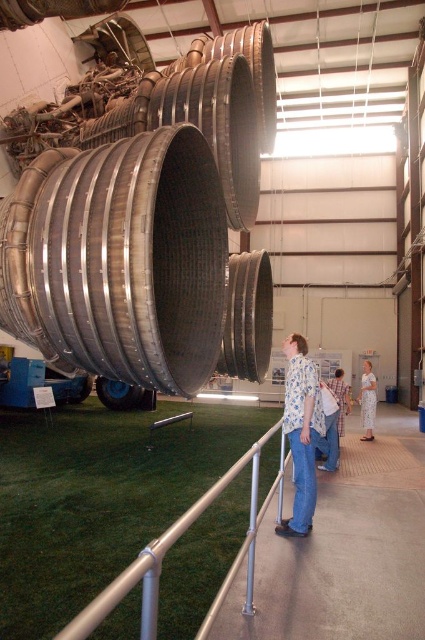
Between point (302, 444) and point (328, 420), which one is positioned behind?

Positioned behind is point (328, 420).

Between floral shirt at center and blue plaid shirt at center, which one has more height?

With more height is floral shirt at center.

Locate an element on the screen. The height and width of the screenshot is (640, 425). floral shirt at center is located at coordinates (302, 433).

Does floral shirt at center appear over white floral dress at center?

Correct, floral shirt at center is located above white floral dress at center.

Is floral shirt at center wider than white floral dress at center?

No.

Between point (312, 394) and point (368, 360), which one is positioned behind?

Positioned behind is point (368, 360).

This screenshot has height=640, width=425. I want to click on floral shirt at center, so click(302, 433).

Between silver metallic rail at center and white floral dress at center, which one appears on the right side from the viewer's perspective?

white floral dress at center

Between point (201, 504) and point (359, 392), which one is positioned in front?

Point (201, 504) is in front.

Is point (282, 456) less distant than point (371, 401)?

Yes.

Image resolution: width=425 pixels, height=640 pixels. In order to click on silver metallic rail at center in this screenshot , I will do `click(172, 545)`.